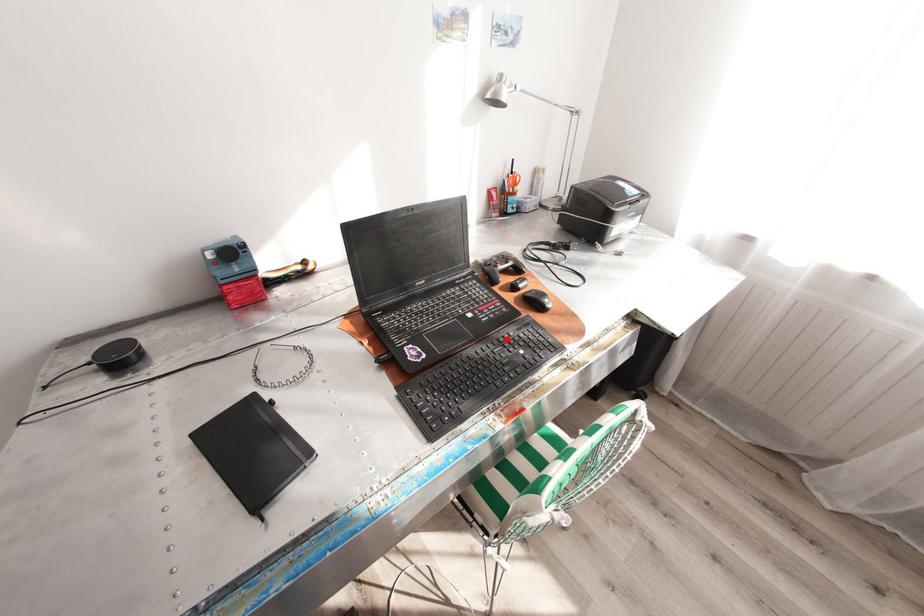
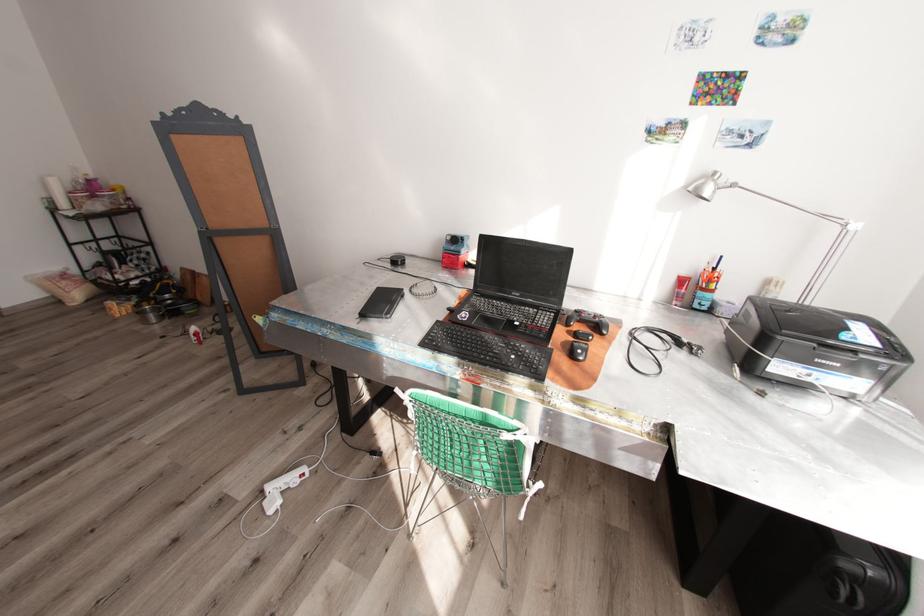
Locate, in the second image, the point that corresponds to the highlighted location in the first image.

(517, 344)